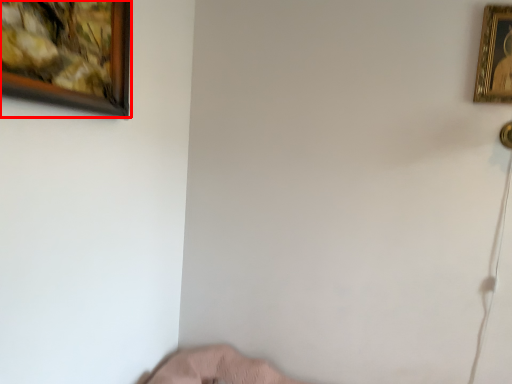
Question: Observing the image, what is the correct spatial positioning of picture frame (annotated by the red box) in reference to picture frame?

Choices:
 (A) right
 (B) left

Answer: (B)